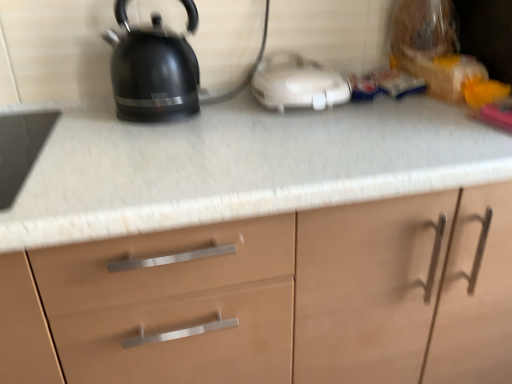
At what (x,y) coordinates should I click in order to perform the action: click on free space in front of white plastic toaster at center. Please return your answer as a coordinate pair (x, y). This screenshot has width=512, height=384. Looking at the image, I should click on (310, 129).